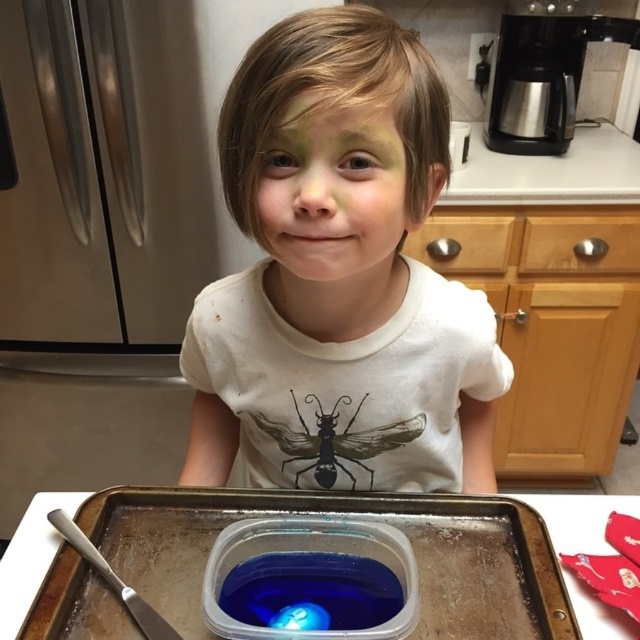
Measure the distance between white matte shirt at center and camera.

white matte shirt at center is 17.46 inches away from camera.

What do you see at coordinates (339, 275) in the screenshot? This screenshot has height=640, width=640. I see `white matte shirt at center` at bounding box center [339, 275].

Which is behind, point (257, 352) or point (364, 257)?

The point (257, 352) is more distant.

You are a GUI agent. You are given a task and a screenshot of the screen. Output one action in this format:
    pyautogui.click(x=<x>, y=<y>)
    Task: Click on the white matte shirt at center
    The height and width of the screenshot is (640, 640).
    Given the screenshot: What is the action you would take?
    pyautogui.click(x=339, y=275)

Can you confirm if white matte shirt at center is wider than black matte insect at center?

Yes, white matte shirt at center is wider than black matte insect at center.

Is white matte shirt at center bigger than black matte insect at center?

Correct, white matte shirt at center is larger in size than black matte insect at center.

Is point (467, 337) behind point (372, 429)?

That is False.

Locate an element on the screen. white matte shirt at center is located at coordinates tap(339, 275).

Does green matte face at center have a lesser width compared to black matte insect at center?

Indeed, green matte face at center has a lesser width compared to black matte insect at center.

Which is above, green matte face at center or black matte insect at center?

green matte face at center is above.

Identify the location of green matte face at center. (332, 189).